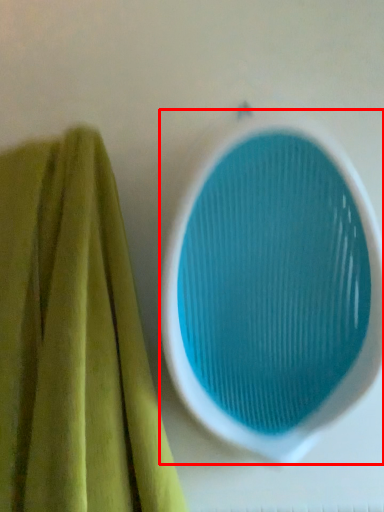
Question: In this image, where is oval (annotated by the red box) located relative to towel?

Choices:
 (A) right
 (B) left

Answer: (A)